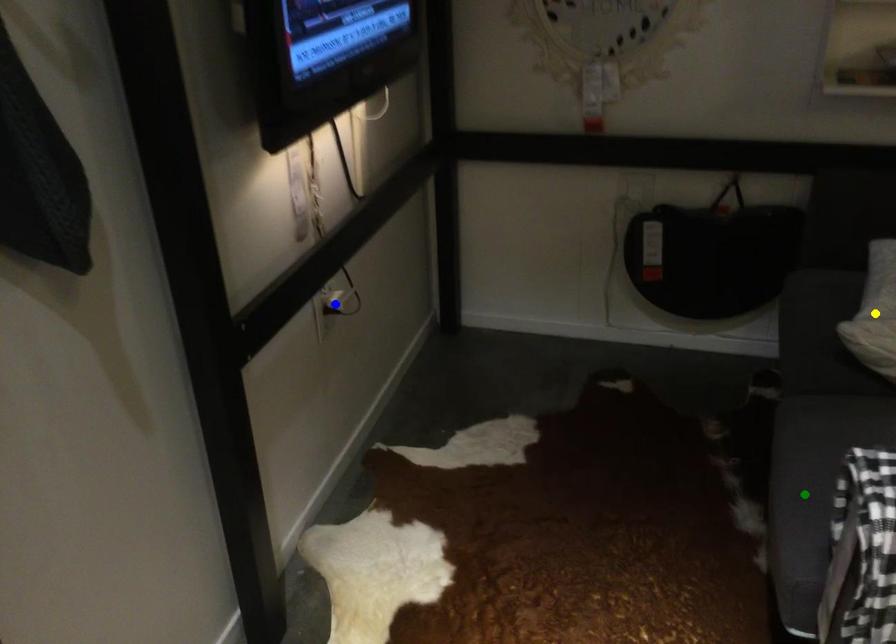
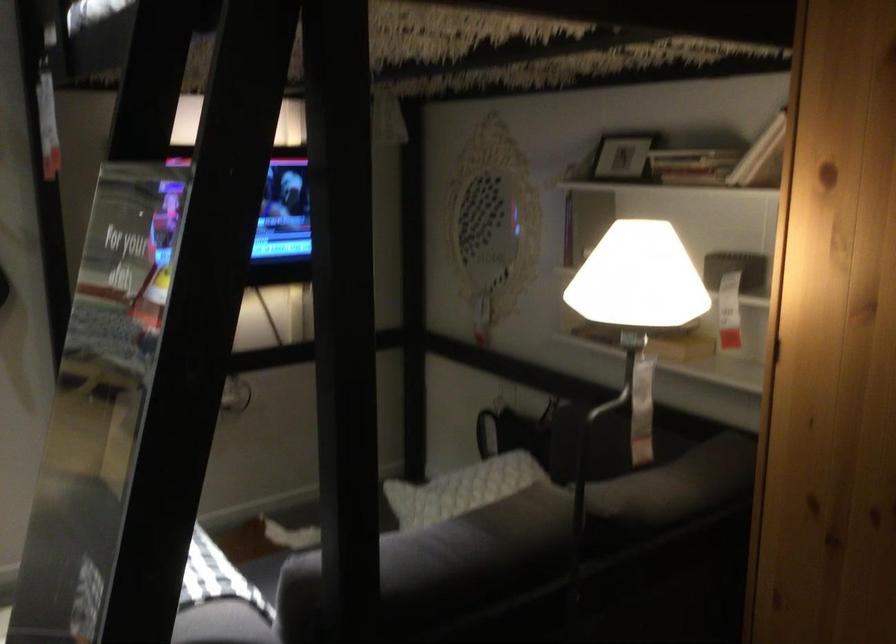
I am providing you with two images of the same scene from different viewpoints. Three points are marked in image1. Which point corresponds to a part or object that is occluded in image2?In image1, three points are marked. Which of them correspond to a part or object that is occluded in image2?Among the three points shown in image1, which one corresponds to a part or object that is no longer visible due to occlusion in image2?

Invisible in image2: yellow point, green point, blue point.